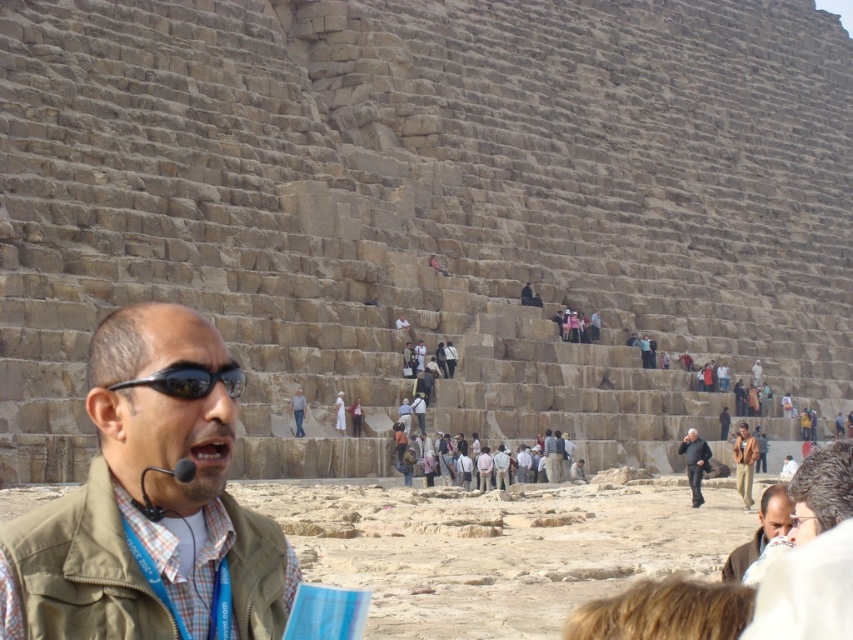
Is dark brown leather jacket at center to the right of light brown leather jacket at center from the viewer's perspective?

Indeed, dark brown leather jacket at center is positioned on the right side of light brown leather jacket at center.

Can you confirm if dark brown leather jacket at center is shorter than light brown leather jacket at center?

No.

Who is more forward, (701, 460) or (548, 476)?

Positioned in front is point (701, 460).

Image resolution: width=853 pixels, height=640 pixels. I want to click on dark brown leather jacket at center, so click(694, 461).

Is point (553, 472) closer to viewer compared to point (300, 404)?

No, (553, 472) is further to viewer.

Can you confirm if light brown leather jacket at center is positioned above matte brown vest at center?

Actually, light brown leather jacket at center is below matte brown vest at center.

Which is behind, point (561, 468) or point (299, 392)?

The point (561, 468) is behind.

The width and height of the screenshot is (853, 640). I want to click on light brown leather jacket at center, so click(553, 456).

Between point (445, 444) and point (555, 460), which one is positioned behind?

Point (555, 460)

Which is above, light brown stone people at center or light brown leather jacket at center?

light brown stone people at center is above.

Is point (561, 480) closer to camera compared to point (560, 468)?

Yes, point (561, 480) is in front of point (560, 468).

At what (x,y) coordinates should I click in order to perform the action: click on light brown stone people at center. Please return your answer as a coordinate pair (x, y). The width and height of the screenshot is (853, 640). Looking at the image, I should click on (451, 464).